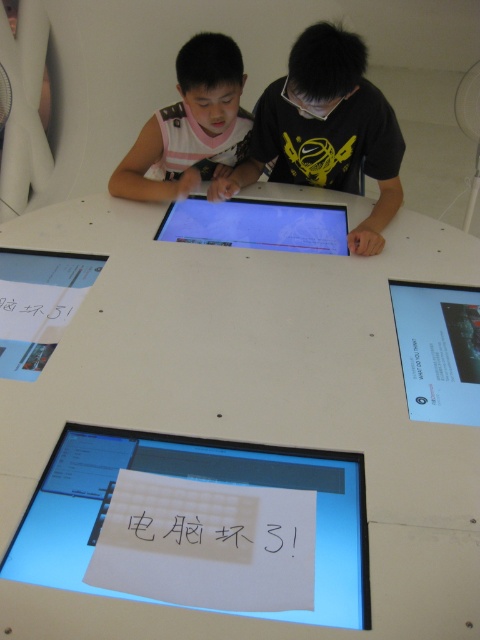
Please provide the coordinates of the white matte table at center in the image. The coordinates should be in the format of a point with two decimal places, such as 0.5,0.5. The answer should be the exact value from the description.

The coordinates of the white matte table at center are at point (237,420).

You are a customer service representative in a tech store. You see a white paper at bottom center and a white matte shirt at center. Which item is shorter in height?

The white paper at bottom center has a lesser height compared to the white matte shirt at center, so the white paper at bottom center is shorter in height.

You are a repair technician holding a tool that requires placing it exactly 3 feet away from the white matte shirt at center. Can you place it on the white paper at bottom center?

The distance between the white paper at bottom center and the white matte shirt at center is 3.71 feet, so placing the tool on the white paper would be 0.71 feet farther than the required 3 feet. Therefore, it won